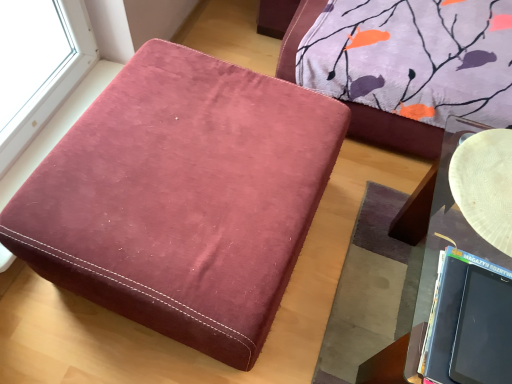
Question: From the image's perspective, is matte black laptop at lower right above or below white textured plate at right?

Choices:
 (A) below
 (B) above

Answer: (A)

Question: Does point (484, 294) appear closer or farther from the camera than point (450, 180)?

Choices:
 (A) closer
 (B) farther

Answer: (A)

Question: Estimate the real-world distances between objects in this image. Which object is farther from the matte black laptop at lower right?

Choices:
 (A) velvet-like burgundy ottoman at center
 (B) white textured plate at right

Answer: (A)

Question: Considering the real-world distances, which object is closest to the matte black laptop at lower right?

Choices:
 (A) velvet-like burgundy ottoman at center
 (B) white textured plate at right

Answer: (B)